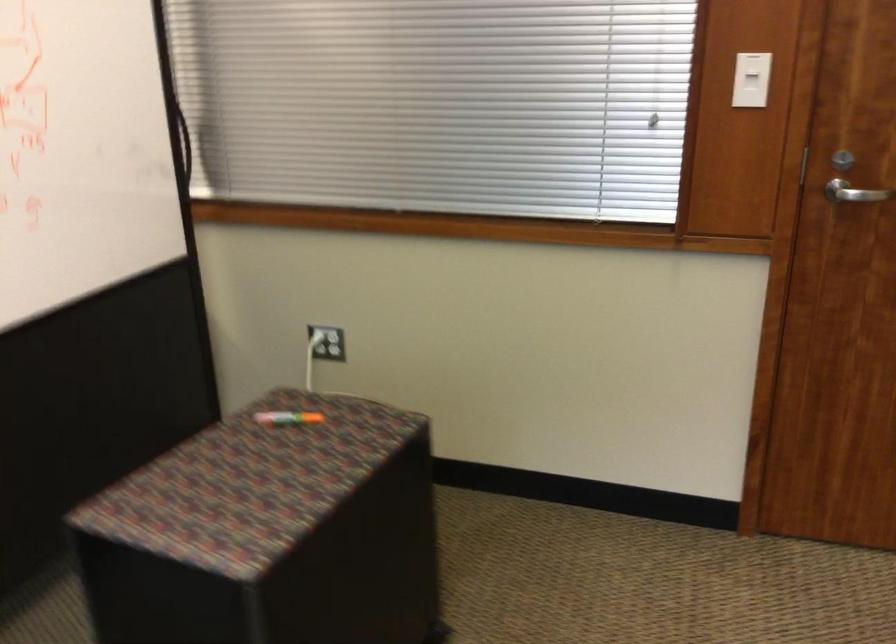
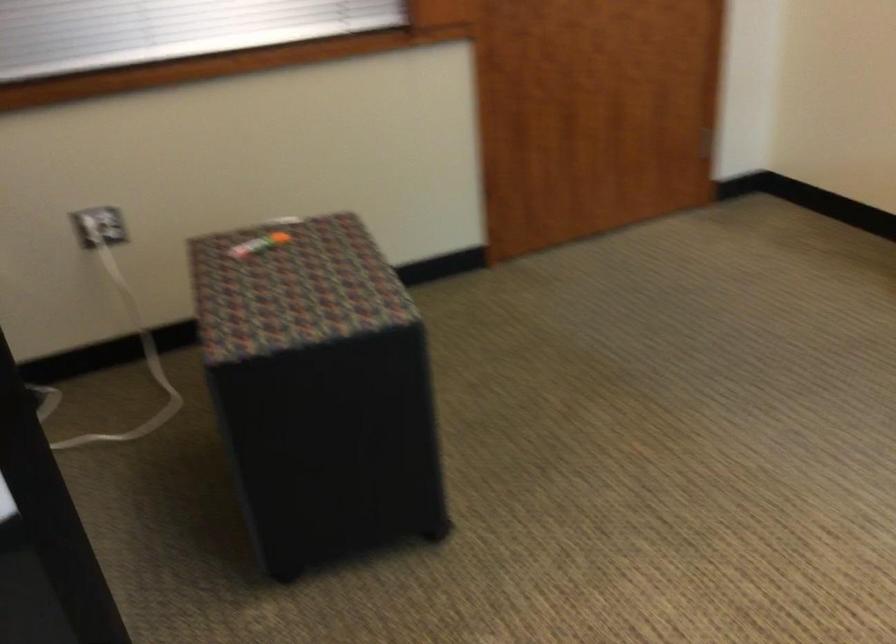
Where in the second image is the point corresponding to [321,337] from the first image?

(92, 231)